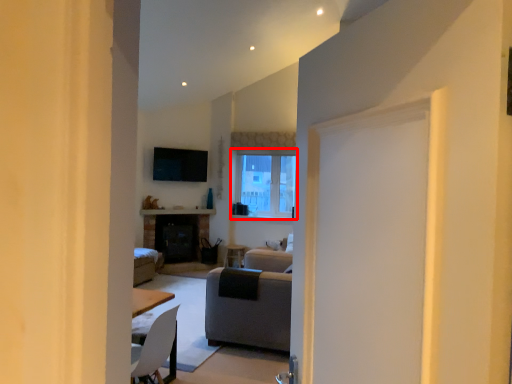
Question: Observing the image, what is the correct spatial positioning of window (annotated by the red box) in reference to studio couch?

Choices:
 (A) right
 (B) left

Answer: (A)